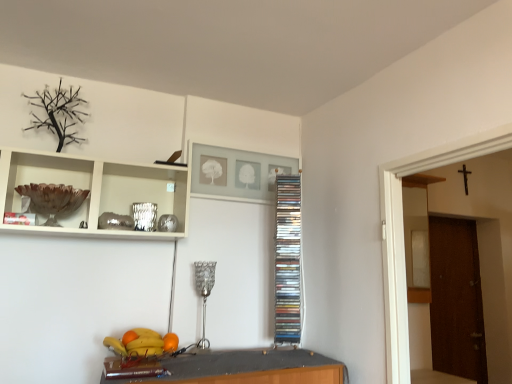
Question: Does silver metallic lamp at center have a lesser width compared to shiny plastic bowl at lower center?

Choices:
 (A) yes
 (B) no

Answer: (A)

Question: Does silver metallic lamp at center have a lesser height compared to shiny plastic bowl at lower center?

Choices:
 (A) yes
 (B) no

Answer: (B)

Question: Is silver metallic lamp at center touching shiny plastic bowl at lower center?

Choices:
 (A) no
 (B) yes

Answer: (A)

Question: Is silver metallic lamp at center oriented away from shiny plastic bowl at lower center?

Choices:
 (A) no
 (B) yes

Answer: (A)

Question: From the image's perspective, is silver metallic lamp at center located beneath shiny plastic bowl at lower center?

Choices:
 (A) yes
 (B) no

Answer: (B)

Question: Considering the positions of shiny plastic bowl at lower center and clear plastic cd rack at center, marked as the second cabinet in a left-to-right arrangement, in the image, is shiny plastic bowl at lower center wider or thinner than clear plastic cd rack at center, marked as the second cabinet in a left-to-right arrangement,?

Choices:
 (A) wide
 (B) thin

Answer: (A)

Question: From a real-world perspective, relative to clear plastic cd rack at center, which is the first cabinet from back to front, is shiny plastic bowl at lower center vertically above or below?

Choices:
 (A) above
 (B) below

Answer: (B)

Question: Does point (152, 344) appear closer or farther from the camera than point (287, 321)?

Choices:
 (A) closer
 (B) farther

Answer: (A)

Question: From their relative heights in the image, would you say shiny plastic bowl at lower center is taller or shorter than clear plastic cd rack at center, which is the first cabinet from back to front?

Choices:
 (A) short
 (B) tall

Answer: (A)

Question: Based on their positions, is orange matte at lower center, the first orange positioned from the right, located to the left or right of orange matte at lower center, marked as the first orange in a left-to-right arrangement?

Choices:
 (A) left
 (B) right

Answer: (B)

Question: From the image's perspective, is orange matte at lower center, the first orange positioned from the right, positioned above or below orange matte at lower center, marked as the first orange in a left-to-right arrangement?

Choices:
 (A) below
 (B) above

Answer: (A)

Question: Is point (168, 332) closer or farther from the camera than point (125, 337)?

Choices:
 (A) farther
 (B) closer

Answer: (A)

Question: Is orange matte at lower center, the first orange positioned from the right, taller or shorter than orange matte at lower center, arranged as the 2th orange when viewed from the right?

Choices:
 (A) tall
 (B) short

Answer: (A)

Question: Looking at the image, does silver metallic lamp at center seem bigger or smaller compared to brown glass bowl at upper left, positioned as the 2th cabinet in back-to-front order?

Choices:
 (A) big
 (B) small

Answer: (B)

Question: From the image's perspective, is silver metallic lamp at center positioned above or below brown glass bowl at upper left, the first cabinet from the left?

Choices:
 (A) above
 (B) below

Answer: (B)